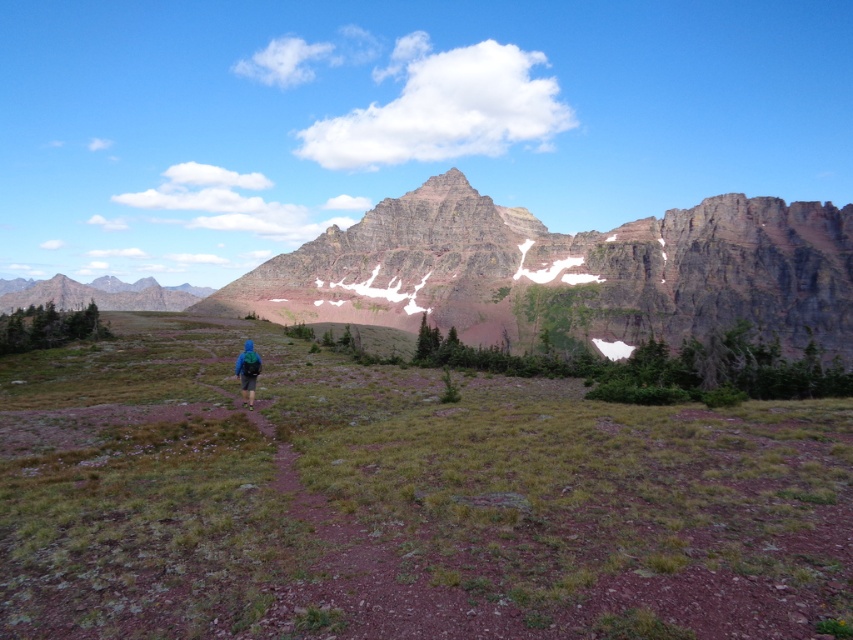
Question: Which point is farther to the camera?

Choices:
 (A) green grassy mountain at lower left
 (B) rugged granite mountain at center

Answer: (A)

Question: Can you confirm if rugged granite mountain at center is positioned to the right of green grassy mountain at lower left?

Choices:
 (A) no
 (B) yes

Answer: (B)

Question: Based on their relative distances, which object is farther from the green grassy mountain at lower left?

Choices:
 (A) blue fabric backpack at center
 (B) rugged granite mountain at center

Answer: (A)

Question: Does rugged granite mountain at center appear on the left side of green grassy mountain at lower left?

Choices:
 (A) no
 (B) yes

Answer: (A)

Question: Observing the image, what is the correct spatial positioning of green grassy mountain at lower left in reference to blue fabric backpack at center?

Choices:
 (A) left
 (B) right

Answer: (A)

Question: Which point is closer to the camera?

Choices:
 (A) (122, 308)
 (B) (247, 403)

Answer: (B)